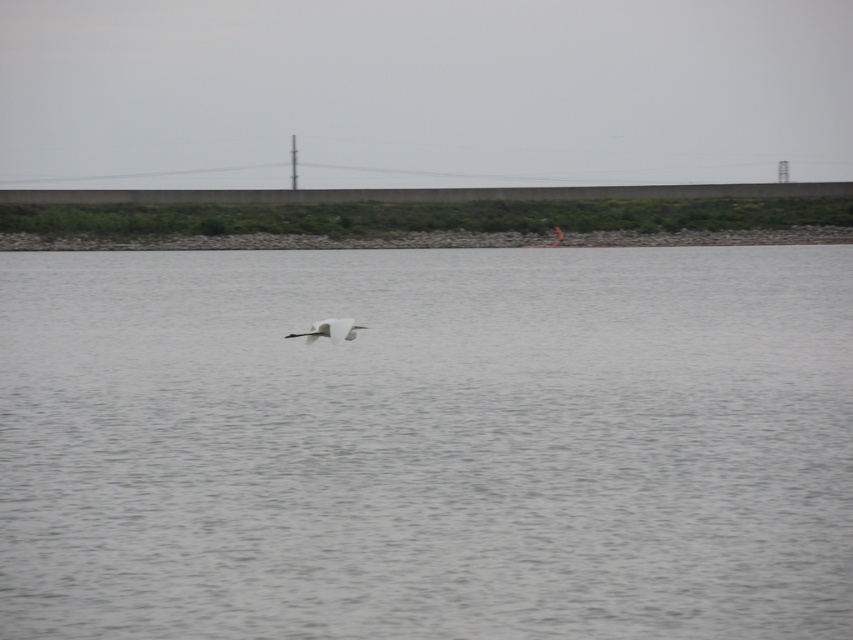
In the scene shown: Is gray water at center thinner than white matte bird at center?

In fact, gray water at center might be wider than white matte bird at center.

Is gray water at center positioned at the back of white matte bird at center?

That is False.

Between point (840, 490) and point (341, 333), which one is positioned behind?

Positioned behind is point (341, 333).

At what (x,y) coordinates should I click in order to perform the action: click on gray water at center. Please return your answer as a coordinate pair (x, y). The image size is (853, 640). Looking at the image, I should click on (427, 444).